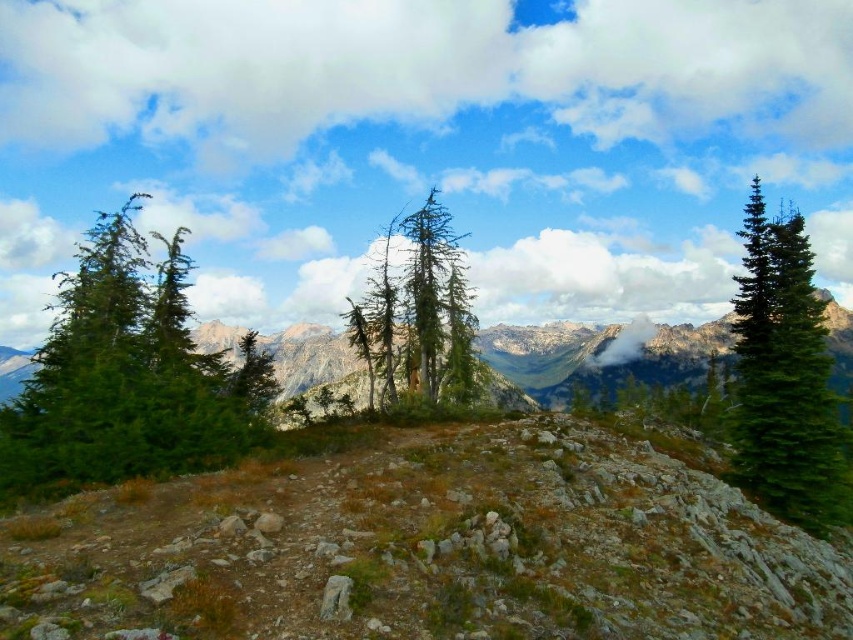
Is green matte tree at right shorter than green textured tree at center?

Indeed, green matte tree at right has a lesser height compared to green textured tree at center.

Locate an element on the screen. green matte tree at right is located at coordinates (782, 376).

Where is `green matte tree at right`? The width and height of the screenshot is (853, 640). green matte tree at right is located at coordinates (782, 376).

Can you confirm if brown rocky hillside at center is positioned above green matte tree at right?

Incorrect, brown rocky hillside at center is not positioned above green matte tree at right.

Is brown rocky hillside at center smaller than green matte tree at right?

Correct, brown rocky hillside at center occupies less space than green matte tree at right.

Between point (538, 433) and point (839, 513), which one is positioned in front?

Point (538, 433)

Image resolution: width=853 pixels, height=640 pixels. Find the location of `brown rocky hillside at center`. brown rocky hillside at center is located at coordinates tap(426, 548).

Can you confirm if green matte tree at left is shorter than green matte tree at center-left?

In fact, green matte tree at left may be taller than green matte tree at center-left.

Can you confirm if green matte tree at left is taller than green matte tree at center-left?

Yes, green matte tree at left is taller than green matte tree at center-left.

What do you see at coordinates (128, 376) in the screenshot? The image size is (853, 640). I see `green matte tree at left` at bounding box center [128, 376].

Image resolution: width=853 pixels, height=640 pixels. Find the location of `green matte tree at left`. green matte tree at left is located at coordinates (128, 376).